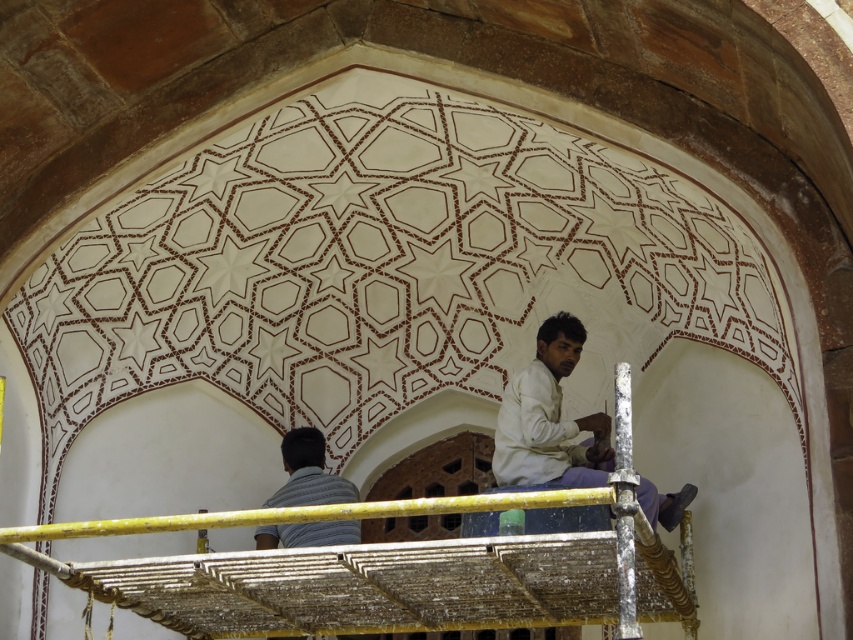
Is point (554, 442) positioned behind point (321, 461)?

No, (554, 442) is closer to viewer.

Measure the distance between point [645,484] and camera.

Point [645,484] is 82.55 meters away from camera.

Does point (550, 342) lie behind point (340, 541)?

No, (550, 342) is closer to viewer.

Find the location of a particular element. white cotton shirt at center is located at coordinates (548, 419).